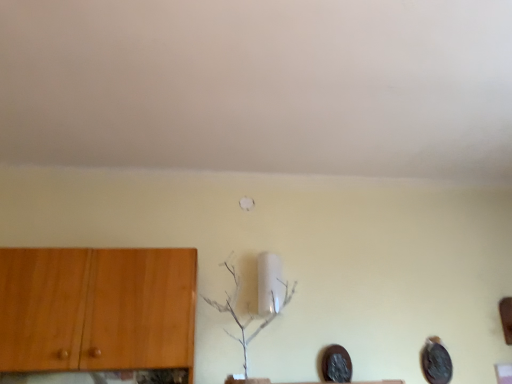
Looking at this image, what is the approximate width of white matte plant at center?

white matte plant at center is 10.15 inches wide.

Describe the element at coordinates (262, 297) in the screenshot. I see `white matte plant at center` at that location.

Where is `white matte plant at center`? Image resolution: width=512 pixels, height=384 pixels. white matte plant at center is located at coordinates (262, 297).

This screenshot has height=384, width=512. Identify the location of white matte plant at center. (262, 297).